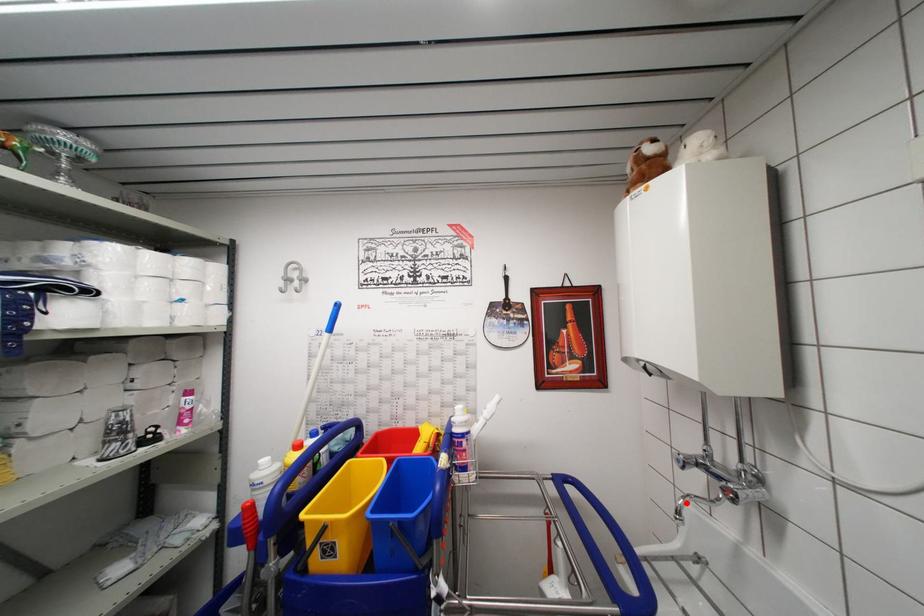
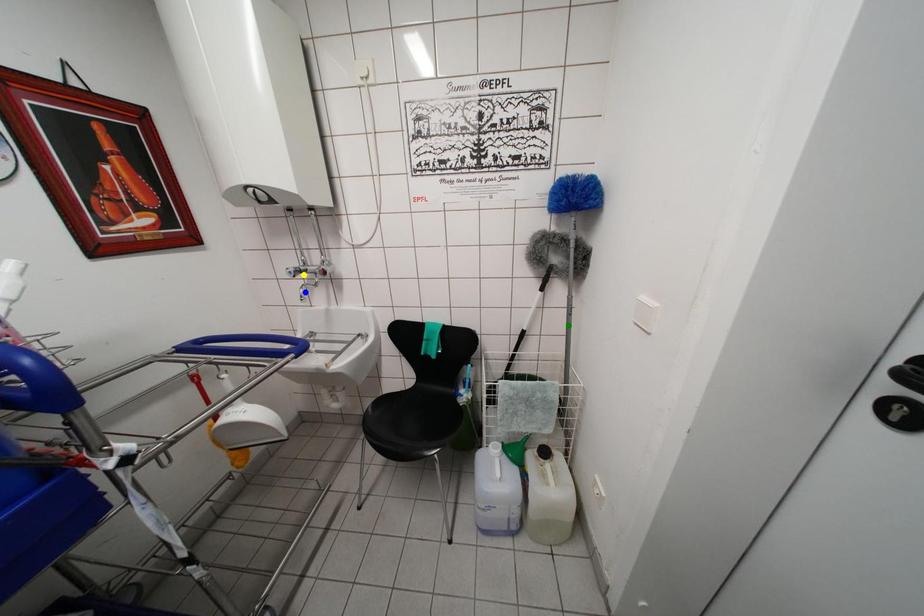
Question: I am providing you with two images of the same scene from different viewpoints. A red point is marked on the first image. You are given multiple points on the second image. Can you choose the point in image 2 that corresponds to the point in image 1?

Choices:
 (A) blue point
 (B) yellow point
 (C) green point

Answer: (A)